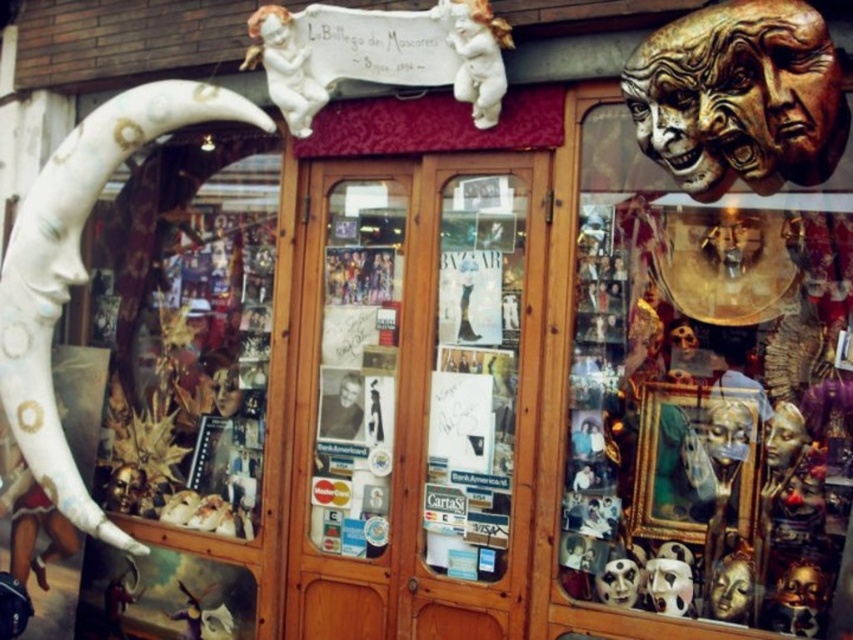
Question: Is gold metallic mask at upper center above wooden glass door at center?

Choices:
 (A) no
 (B) yes

Answer: (B)

Question: Where is gold textured mask at upper right located in relation to white painted wood at left in the image?

Choices:
 (A) right
 (B) left

Answer: (A)

Question: Which of these objects is positioned closest to the gold textured mask at upper right?

Choices:
 (A) wooden glass door at center
 (B) gold metallic mask at upper center
 (C) white painted wood at left

Answer: (B)

Question: Which point is closer to the camera?

Choices:
 (A) (291, 547)
 (B) (753, 16)
 (C) (680, 456)

Answer: (B)

Question: From the image, what is the correct spatial relationship of gold textured mask at upper right in relation to white painted wood at left?

Choices:
 (A) left
 (B) right

Answer: (B)

Question: Which object appears farthest from the camera in this image?

Choices:
 (A) gold metallic mask at upper center
 (B) white painted wood at left
 (C) gold textured mask at upper right
 (D) wooden glass door at center

Answer: (B)